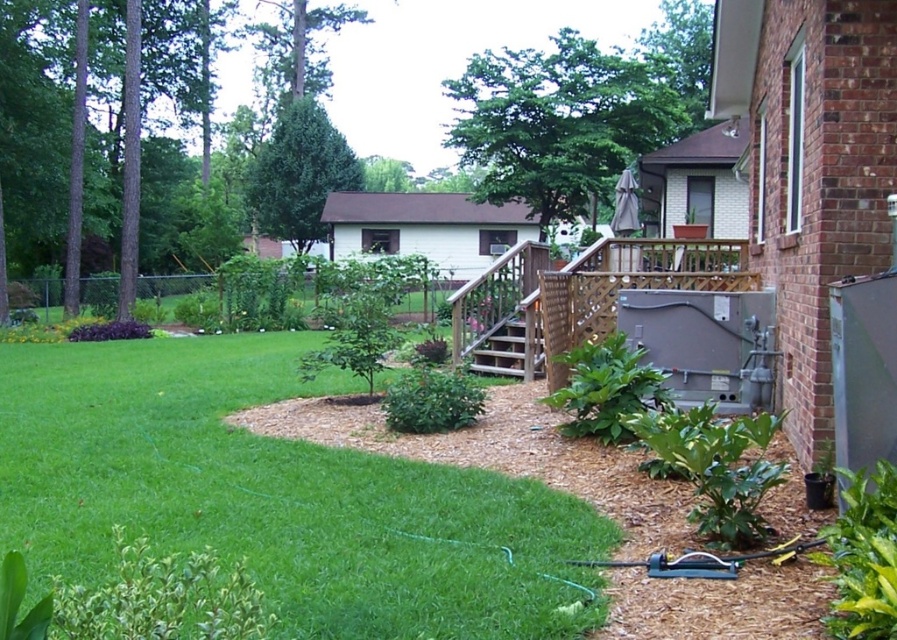
Question: Where is green grass at lower left located in relation to wooden stairs at center in the image?

Choices:
 (A) above
 (B) below

Answer: (B)

Question: Which object is the farthest from the green grass at lower left?

Choices:
 (A) wooden stairs at center
 (B) brown wooden porch at center

Answer: (B)

Question: Which of the following is the farthest from the observer?

Choices:
 (A) (469, 289)
 (B) (480, 372)
 (C) (218, 387)

Answer: (A)

Question: Does green grass at lower left come in front of wooden stairs at center?

Choices:
 (A) yes
 (B) no

Answer: (A)

Question: Which object is closer to the camera taking this photo?

Choices:
 (A) brown wooden porch at center
 (B) green grass at lower left

Answer: (B)

Question: Observing the image, what is the correct spatial positioning of brown wooden porch at center in reference to wooden stairs at center?

Choices:
 (A) left
 (B) right

Answer: (A)